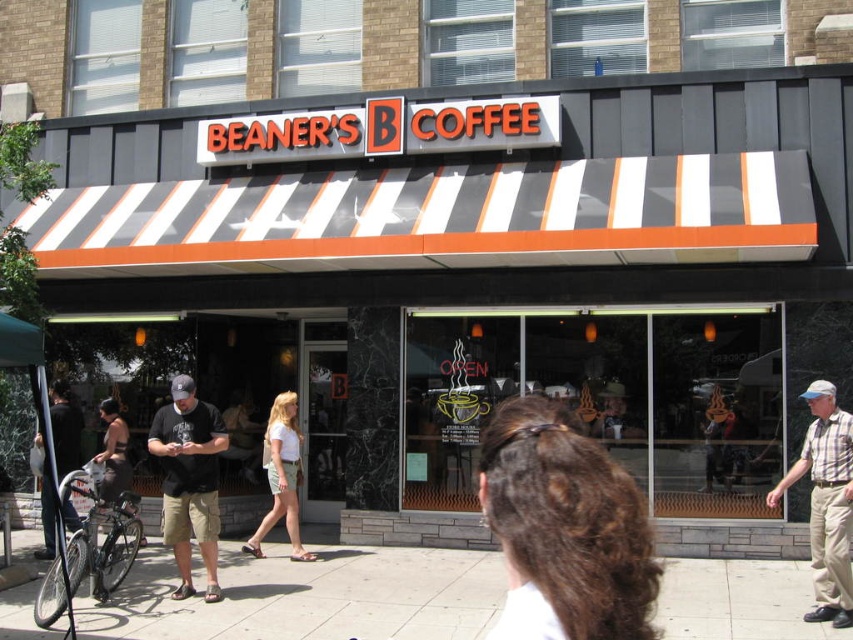
Can you confirm if plaid shirt at right is wider than dark gray shorts at left?

Incorrect, plaid shirt at right's width does not surpass dark gray shorts at left's.

What do you see at coordinates (827, 502) in the screenshot? I see `plaid shirt at right` at bounding box center [827, 502].

At what (x,y) coordinates should I click in order to perform the action: click on plaid shirt at right. Please return your answer as a coordinate pair (x, y). This screenshot has width=853, height=640. Looking at the image, I should click on (827, 502).

Does dark gray t-shirt at center appear on the right side of plaid shirt at right?

No, dark gray t-shirt at center is not to the right of plaid shirt at right.

How distant is dark gray t-shirt at center from plaid shirt at right?

15.69 feet

Describe the element at coordinates (189, 481) in the screenshot. Image resolution: width=853 pixels, height=640 pixels. I see `dark gray t-shirt at center` at that location.

Where is `dark gray t-shirt at center`? The image size is (853, 640). dark gray t-shirt at center is located at coordinates (189, 481).

What do you see at coordinates (189, 481) in the screenshot?
I see `dark gray t-shirt at center` at bounding box center [189, 481].

Looking at this image, is dark gray t-shirt at center smaller than dark brown leather jacket at center?

No, dark gray t-shirt at center is not smaller than dark brown leather jacket at center.

Image resolution: width=853 pixels, height=640 pixels. What do you see at coordinates (189, 481) in the screenshot? I see `dark gray t-shirt at center` at bounding box center [189, 481].

The image size is (853, 640). I want to click on dark gray t-shirt at center, so click(x=189, y=481).